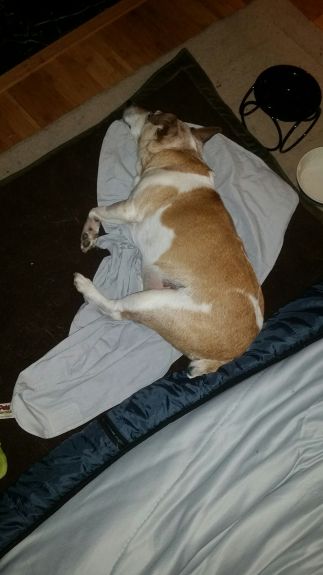
Find the location of a particular element. This screenshot has width=323, height=575. food bowl stand is located at coordinates (273, 120).